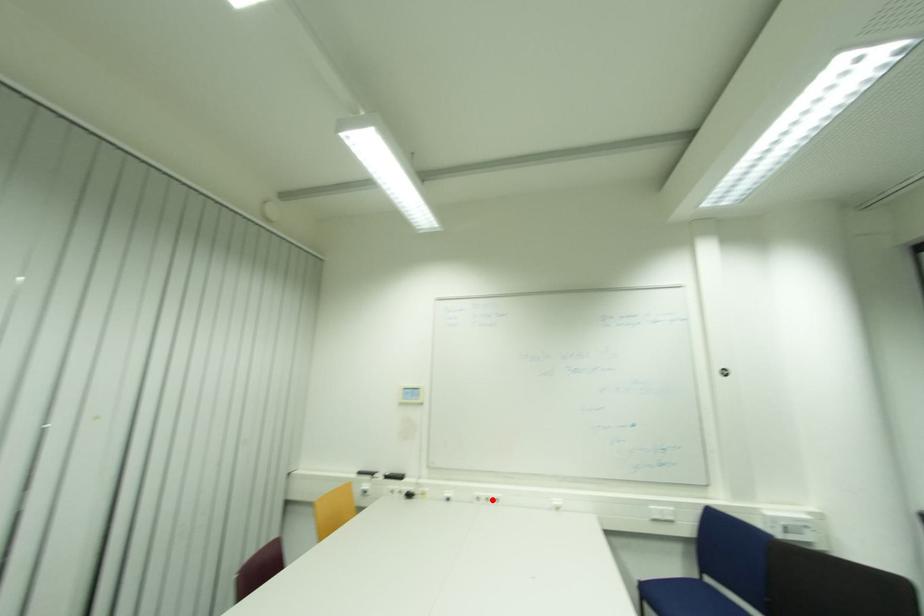
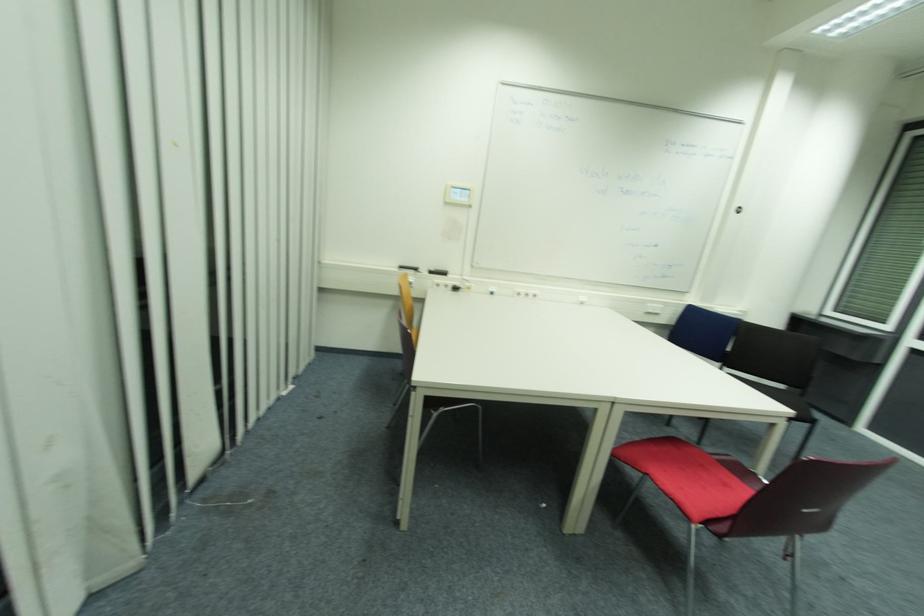
Where in the second image is the point corresponding to the highlighted location from the first image?

(529, 294)